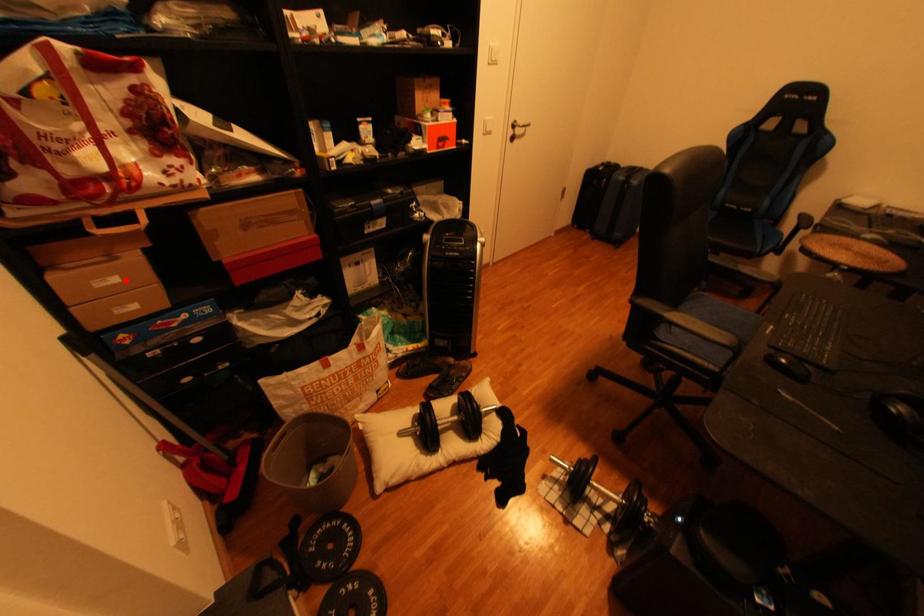
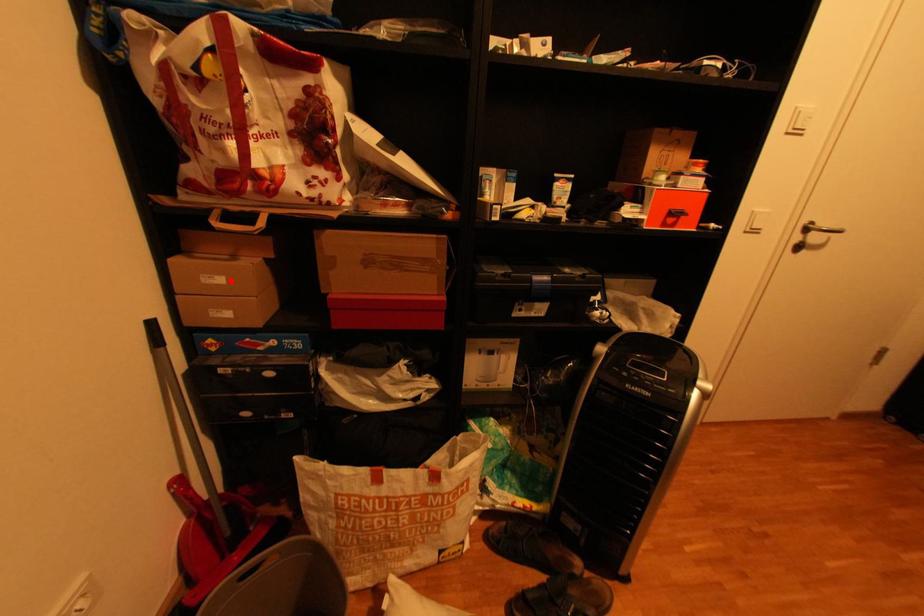
I am providing you with two images of the same scene from different viewpoints. A red point is marked on the first image and another point is marked on the second image. Is the red point in image1 aligned with the point shown in image2?

Yes